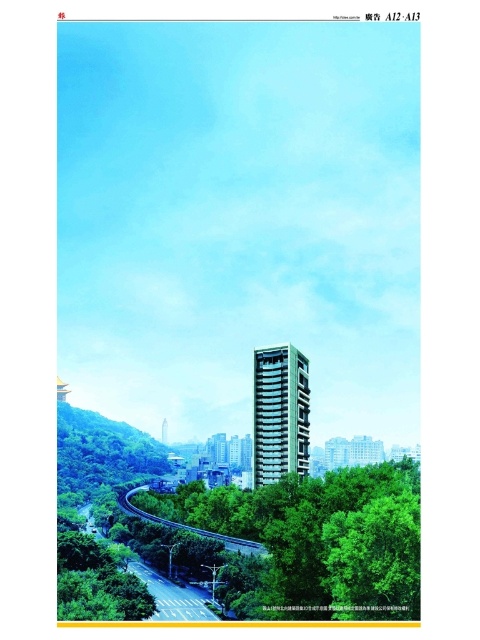
Question: Does green leafy tree at lower center appear under sandy beige concrete building at center?

Choices:
 (A) no
 (B) yes

Answer: (B)

Question: Among these points, which one is nearest to the camera?

Choices:
 (A) (191, 493)
 (B) (282, 429)

Answer: (B)

Question: Can you confirm if green leafy tree at lower center is smaller than sandy beige concrete building at center?

Choices:
 (A) no
 (B) yes

Answer: (A)

Question: Does green leafy tree at lower center appear on the left side of sandy beige concrete building at center?

Choices:
 (A) yes
 (B) no

Answer: (A)